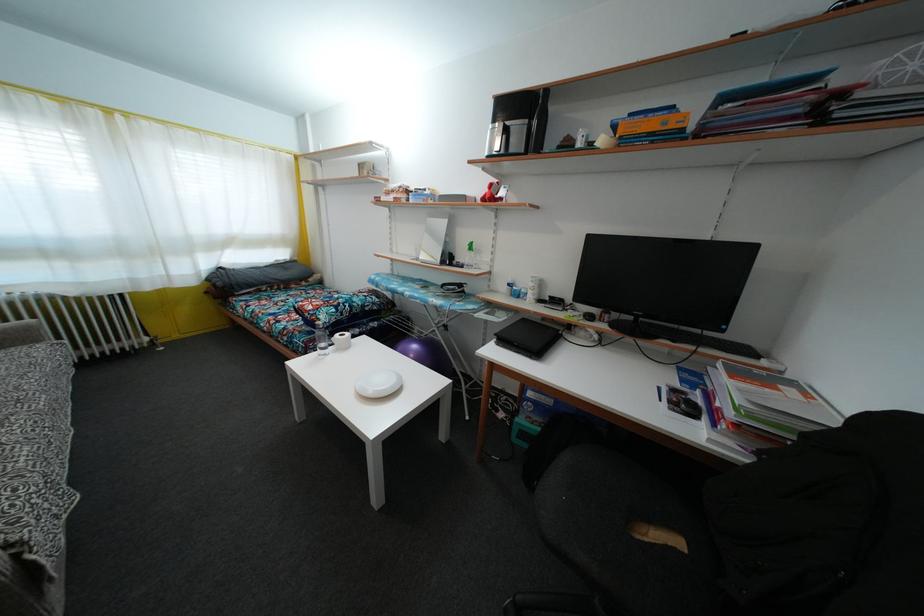
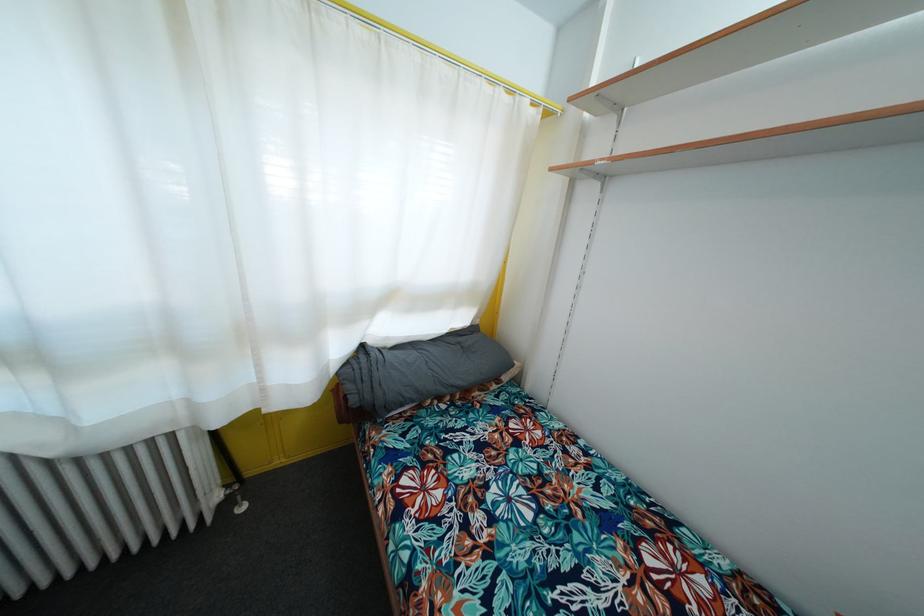
Where in the second image is the point corresponding to pixel 224 291 from the first image?

(358, 407)